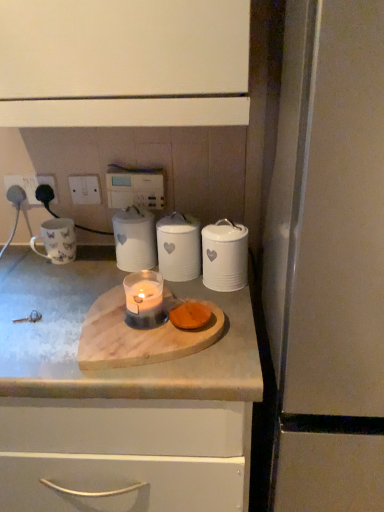
What are the coordinates of `vacant area that lies between white ceramic canister at center, the 3th kitchen appliance from the right, and matte white mug at left` in the screenshot? It's located at (92, 264).